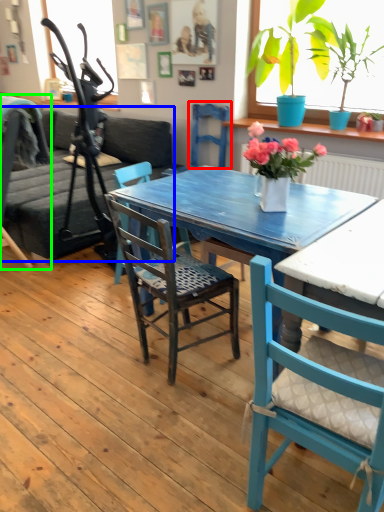
Question: Which object is positioned closest to armchair (highlighted by a red box)? Select from studio couch (highlighted by a blue box) and chair (highlighted by a green box).

Choices:
 (A) studio couch
 (B) chair

Answer: (A)